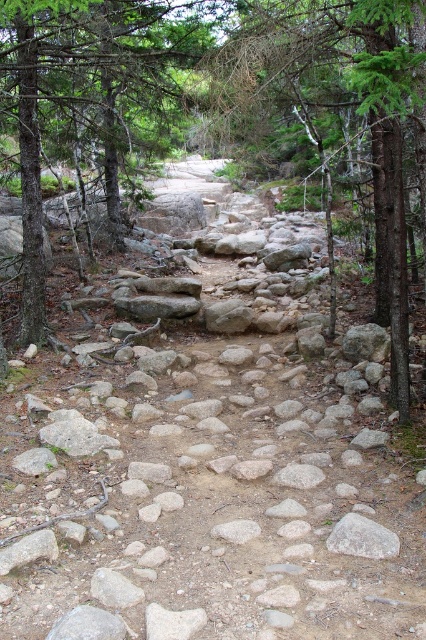
Question: Considering the real-world distances, which object is farthest from the white smooth rock at center?

Choices:
 (A) gray rough rock at center
 (B) gray smooth rock at center
 (C) green textured tree at center

Answer: (C)

Question: Can you confirm if green textured tree at center is positioned below white smooth rock at center?

Choices:
 (A) no
 (B) yes

Answer: (A)

Question: Which point is closer to the camera?

Choices:
 (A) white smooth rock at center
 (B) green textured tree at center

Answer: (A)

Question: Among these points, which one is nearest to the camera?

Choices:
 (A) (373, 64)
 (B) (368, 534)
 (C) (293, 486)

Answer: (A)

Question: Is green textured tree at center to the right of white smooth rock at center from the viewer's perspective?

Choices:
 (A) yes
 (B) no

Answer: (A)

Question: In this image, where is gray rough rock at center located relative to gray smooth rock at center?

Choices:
 (A) left
 (B) right

Answer: (B)